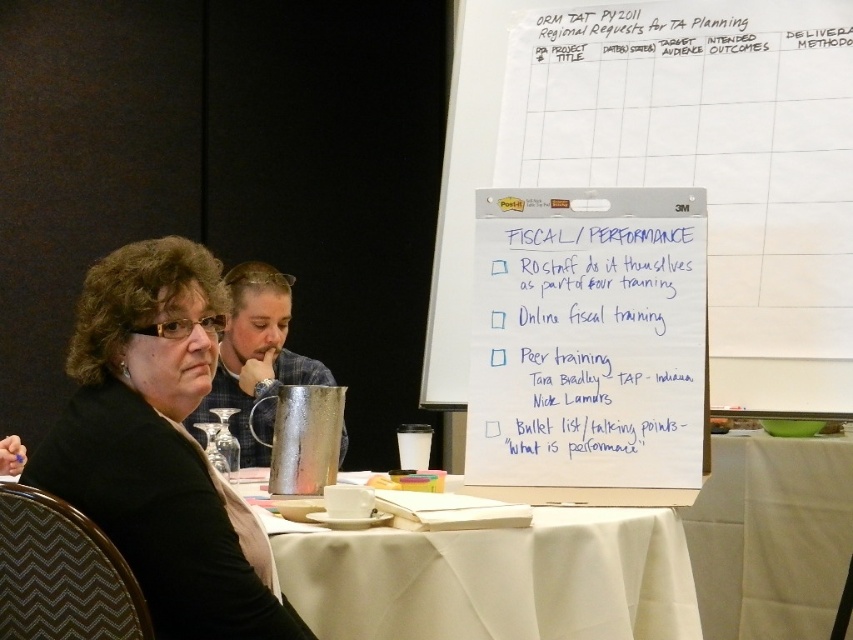
Can you confirm if white paperboard at upper center is positioned above white cloth at center?

Yes.

Between point (635, 253) and point (654, 576), which one is positioned in front?

Point (654, 576) is in front.

Locate an element on the screen. The height and width of the screenshot is (640, 853). white paperboard at upper center is located at coordinates (589, 348).

This screenshot has height=640, width=853. Describe the element at coordinates (160, 445) in the screenshot. I see `black fabric jacket at left` at that location.

Does point (125, 280) lie in front of point (544, 584)?

Yes.

Does point (68, 468) come farther from viewer compared to point (606, 609)?

No, (68, 468) is closer to viewer.

Image resolution: width=853 pixels, height=640 pixels. Find the location of `black fabric jacket at left`. black fabric jacket at left is located at coordinates (160, 445).

Who is positioned more to the left, white paperboard at upper center or white cloth at lower right?

From the viewer's perspective, white paperboard at upper center appears more on the left side.

Can you confirm if white paperboard at upper center is positioned to the right of white cloth at lower right?

No, white paperboard at upper center is not to the right of white cloth at lower right.

Find the location of a particular element. This screenshot has width=853, height=640. white paperboard at upper center is located at coordinates (589, 348).

You are a GUI agent. You are given a task and a screenshot of the screen. Output one action in this format:
    pyautogui.click(x=<x>, y=<y>)
    Task: Click on the white paperboard at upper center
    The height and width of the screenshot is (640, 853).
    Given the screenshot: What is the action you would take?
    pyautogui.click(x=589, y=348)